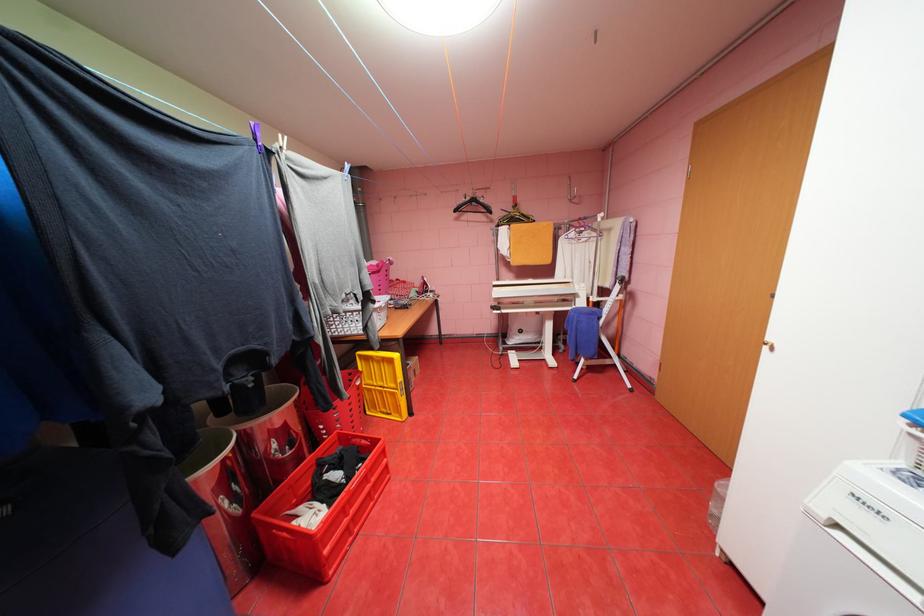
Describe the element at coordinates (257, 136) in the screenshot. I see `the purple clothespin` at that location.